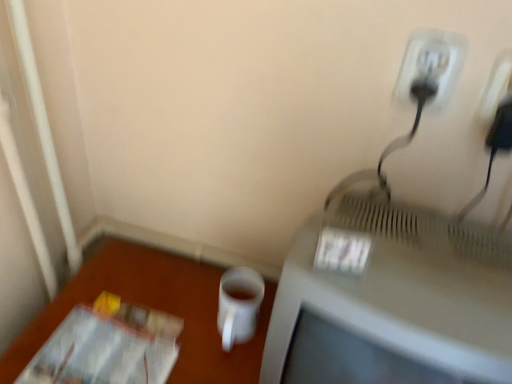
Question: Should I look upward or downward to see matte gray television at right?

Choices:
 (A) up
 (B) down

Answer: (B)

Question: Is matte gray television at right far from white matte cup at lower right?

Choices:
 (A) no
 (B) yes

Answer: (A)

Question: Considering the relative sizes of matte gray television at right and white matte cup at lower right in the image provided, is matte gray television at right taller than white matte cup at lower right?

Choices:
 (A) yes
 (B) no

Answer: (B)

Question: Does matte gray television at right appear on the right side of white matte cup at lower right?

Choices:
 (A) no
 (B) yes

Answer: (B)

Question: From a real-world perspective, does matte gray television at right sit lower than white matte cup at lower right?

Choices:
 (A) no
 (B) yes

Answer: (A)

Question: Is matte gray television at right closer to camera compared to white matte cup at lower right?

Choices:
 (A) no
 (B) yes

Answer: (B)

Question: Does matte gray television at right contain white matte cup at lower right?

Choices:
 (A) no
 (B) yes

Answer: (A)

Question: Is white matte cup at lower right at the left side of white plastic outlet at upper right?

Choices:
 (A) yes
 (B) no

Answer: (A)

Question: From the image's perspective, would you say white matte cup at lower right is positioned over white plastic outlet at upper right?

Choices:
 (A) no
 (B) yes

Answer: (A)

Question: Is white matte cup at lower right looking in the opposite direction of white plastic outlet at upper right?

Choices:
 (A) yes
 (B) no

Answer: (B)

Question: Is white matte cup at lower right aimed at white plastic outlet at upper right?

Choices:
 (A) no
 (B) yes

Answer: (A)

Question: Are white matte cup at lower right and white plastic outlet at upper right located far from each other?

Choices:
 (A) no
 (B) yes

Answer: (A)

Question: From a real-world perspective, is white matte cup at lower right positioned over white plastic outlet at upper right based on gravity?

Choices:
 (A) no
 (B) yes

Answer: (A)

Question: Considering the relative positions of transparent plastic magazine at lower left and white plastic outlet at upper right in the image provided, is transparent plastic magazine at lower left to the left of white plastic outlet at upper right from the viewer's perspective?

Choices:
 (A) yes
 (B) no

Answer: (A)